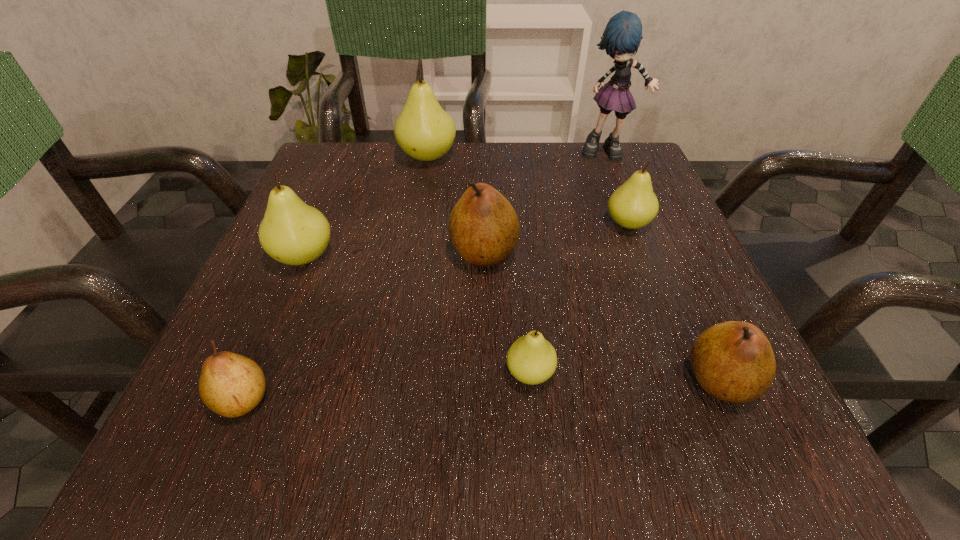
Locate an element on the screen. Image resolution: width=960 pixels, height=540 pixels. rag doll is located at coordinates (621, 38).

Image resolution: width=960 pixels, height=540 pixels. Find the location of `blue rag doll`. blue rag doll is located at coordinates (621, 38).

At what (x,y) coordinates should I click in order to perform the action: click on the farthest green pear. Please return your answer as a coordinate pair (x, y). Looking at the image, I should click on (424, 131).

This screenshot has height=540, width=960. What are the coordinates of `the third green pear from right to left` in the screenshot? It's located at (424, 131).

Where is `the biggest brown pear`? the biggest brown pear is located at coordinates (484, 229).

At what (x,y) coordinates should I click in order to perform the action: click on the second brown pear from left to right. Please return your answer as a coordinate pair (x, y). The height and width of the screenshot is (540, 960). Looking at the image, I should click on (484, 229).

Where is `the leftmost green pear`? The image size is (960, 540). the leftmost green pear is located at coordinates (291, 232).

I want to click on the rightmost green pear, so click(x=633, y=205).

This screenshot has height=540, width=960. Identify the location of the rightmost brown pear. (733, 361).

Find the location of a particular element. Image resolution: width=960 pixels, height=540 pixels. the leftmost brown pear is located at coordinates (231, 385).